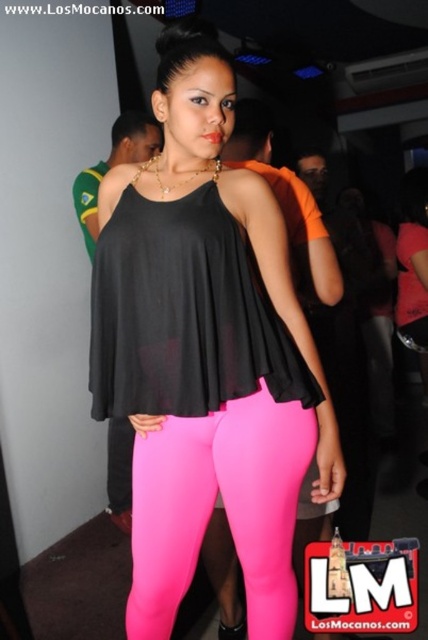
Does matte black top at center have a greater height compared to neon pink leggings at center?

Correct, matte black top at center is much taller as neon pink leggings at center.

Identify the location of matte black top at center. (205, 353).

Identify the location of matte black top at center. (205, 353).